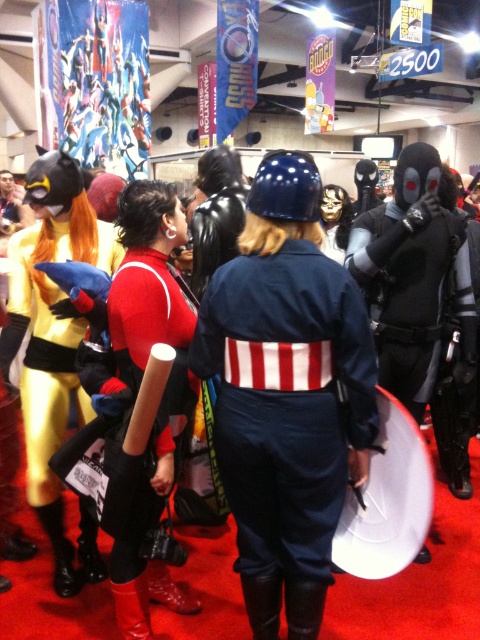
You are a photographer at the event and need to capture a clear photo of both the rubberized red boots at center and the shiny black helmet at center. However, the boots are blocking the helmet slightly. Can you adjust your position to ensure both are visible without moving either object?

The rubberized red boots at center are in front of the shiny black helmet at center. By moving your camera angle slightly backward or to the side, you can capture both objects in the frame without obstruction.

In the scene shown: You are a photographer at the event and want to capture a photo that includes both the yellow fabric costume at left and the shiny metallic armor at upper left. Based on their positions, which costume should you focus on first to ensure both are in frame?

The yellow fabric costume at left is below the shiny metallic armor at upper left, so you should focus on the shiny metallic armor at upper left first to ensure both are in frame.